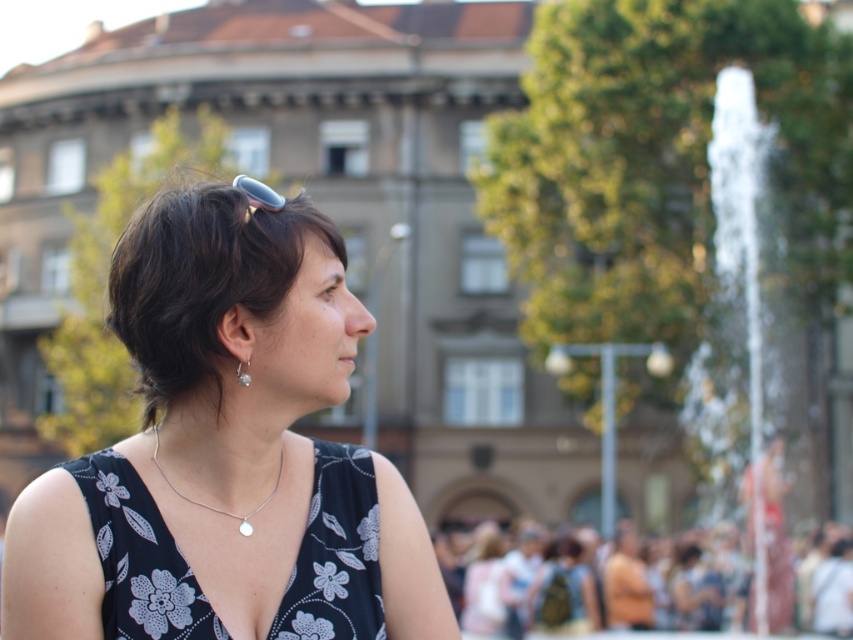
Image resolution: width=853 pixels, height=640 pixels. Describe the element at coordinates (202, 278) in the screenshot. I see `dark brown hair at center` at that location.

Between point (184, 344) and point (728, 576), which one is positioned behind?

The point (728, 576) is more distant.

Where is `dark brown hair at center`? The height and width of the screenshot is (640, 853). dark brown hair at center is located at coordinates (202, 278).

Does black floral dress at center appear on the left side of silver metallic necklace at center?

In fact, black floral dress at center is to the right of silver metallic necklace at center.

Who is more forward, (315, 612) or (277, 467)?

Point (315, 612) is in front.

The image size is (853, 640). What are the coordinates of `black floral dress at center` in the screenshot? It's located at (223, 435).

Is black floral fabric dress at center to the right of silver metallic necklace at center from the viewer's perspective?

Indeed, black floral fabric dress at center is positioned on the right side of silver metallic necklace at center.

Can you confirm if black floral fabric dress at center is taller than silver metallic necklace at center?

Yes, black floral fabric dress at center is taller than silver metallic necklace at center.

Does point (343, 486) lie in front of point (277, 467)?

That is False.

Identify the location of black floral fabric dress at center. The width and height of the screenshot is (853, 640). (138, 557).